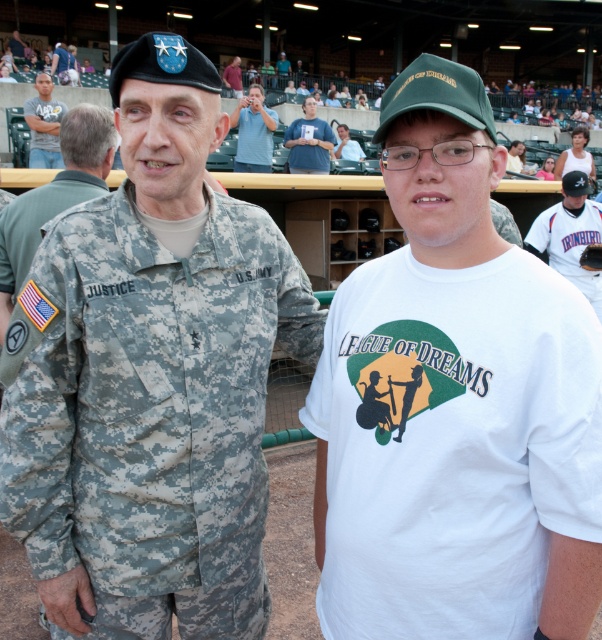
From the picture: Measure the distance between point (54, 420) and camera.

Point (54, 420) and camera are 1.68 meters apart from each other.

Looking at this image, is camouflage uniform at center shorter than matte gray t-shirt at upper left?

Correct, camouflage uniform at center is not as tall as matte gray t-shirt at upper left.

Which is in front, point (193, 548) or point (45, 115)?

Point (193, 548) is more forward.

Identify the location of camouflage uniform at center. (150, 378).

Which of these two, white jersey at right or matte gray t-shirt at upper left, stands shorter?

With less height is white jersey at right.

Can you confirm if white jersey at right is positioned to the left of matte gray t-shirt at upper left?

No, white jersey at right is not to the left of matte gray t-shirt at upper left.

Who is more distant from viewer, (600,241) or (40,134)?

Point (40,134)

Identify the location of white jersey at right. This screenshot has width=602, height=640. (571, 236).

Is light blue shirt at center below matte black beret at upper center?

Indeed, light blue shirt at center is positioned under matte black beret at upper center.

Locate an element on the screen. The width and height of the screenshot is (602, 640). light blue shirt at center is located at coordinates (346, 145).